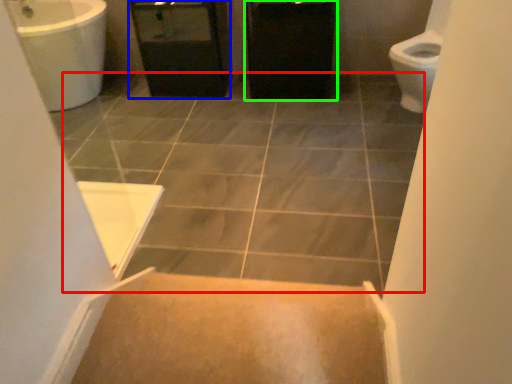
Question: Which is nearer to the ceramic tile (highlighted by a red box)? screen door (highlighted by a blue box) or cabinetry (highlighted by a green box).

Choices:
 (A) screen door
 (B) cabinetry

Answer: (B)